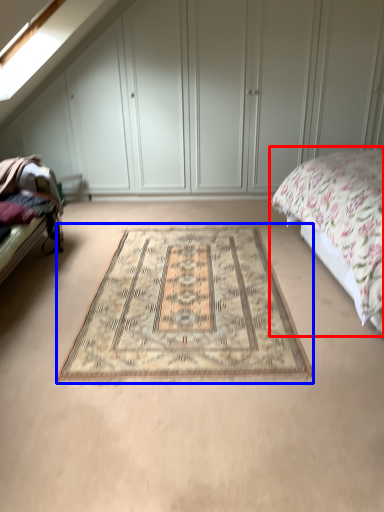
Question: Which point is further to the camera, bed (highlighted by a red box) or mat (highlighted by a blue box)?

Choices:
 (A) bed
 (B) mat

Answer: (B)